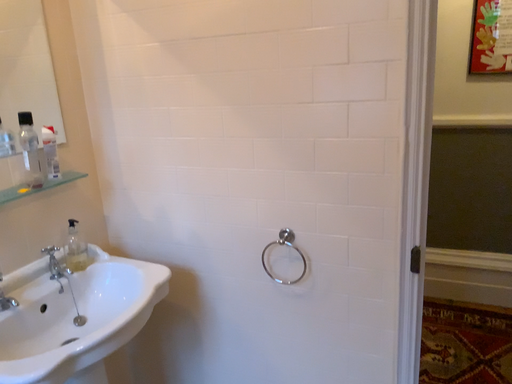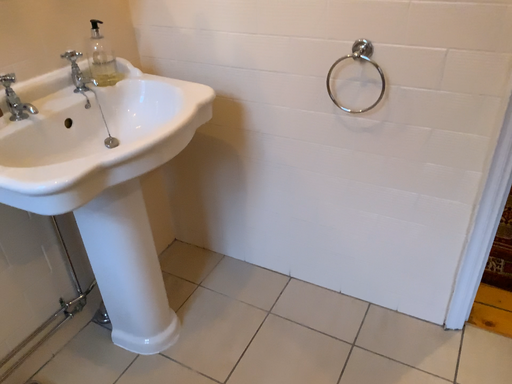
Question: How did the camera likely rotate when shooting the video?

Choices:
 (A) rotated upward
 (B) rotated downward

Answer: (B)